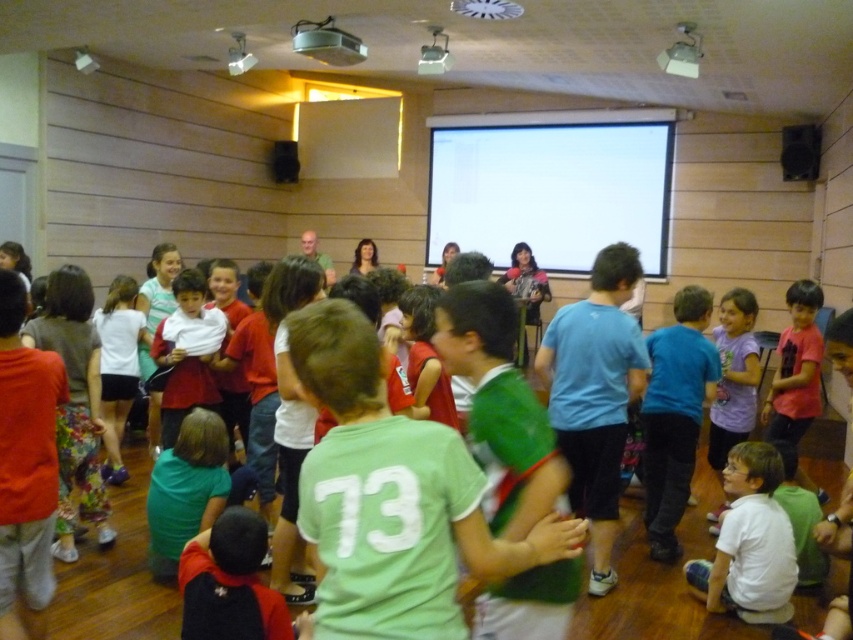
Is white glossy projection screen at upper center thinner than purple matte shirt at lower right?

Incorrect, white glossy projection screen at upper center's width is not less than purple matte shirt at lower right's.

I want to click on white glossy projection screen at upper center, so click(x=550, y=189).

Is white cotton shirt at lower left shorter than matte red shirt at center?

No, white cotton shirt at lower left is not shorter than matte red shirt at center.

Can you confirm if white cotton shirt at lower left is positioned above matte red shirt at center?

No.

Is point (117, 432) positioned in front of point (154, 353)?

That is False.

Locate an element on the screen. white cotton shirt at lower left is located at coordinates (119, 365).

Can you confirm if green jersey at center is wider than purple matte shirt at lower right?

Yes, green jersey at center is wider than purple matte shirt at lower right.

Is green jersey at center positioned behind purple matte shirt at lower right?

No, it is not.

Measure the distance between point (316, 378) and camera.

Point (316, 378) is 1.33 meters away from camera.

At what (x,y) coordinates should I click in order to perform the action: click on green jersey at center. Please return your answer as a coordinate pair (x, y). Looking at the image, I should click on (392, 497).